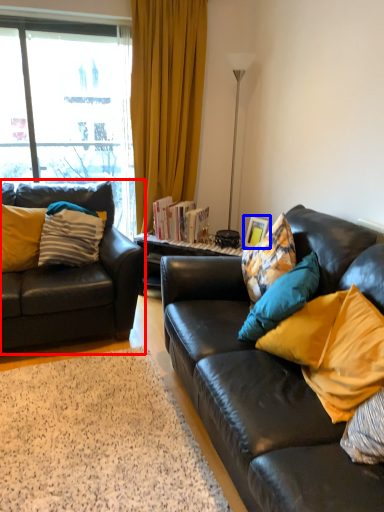
Question: Which object is further to the camera taking this photo, studio couch (highlighted by a red box) or picture frame (highlighted by a blue box)?

Choices:
 (A) studio couch
 (B) picture frame

Answer: (B)